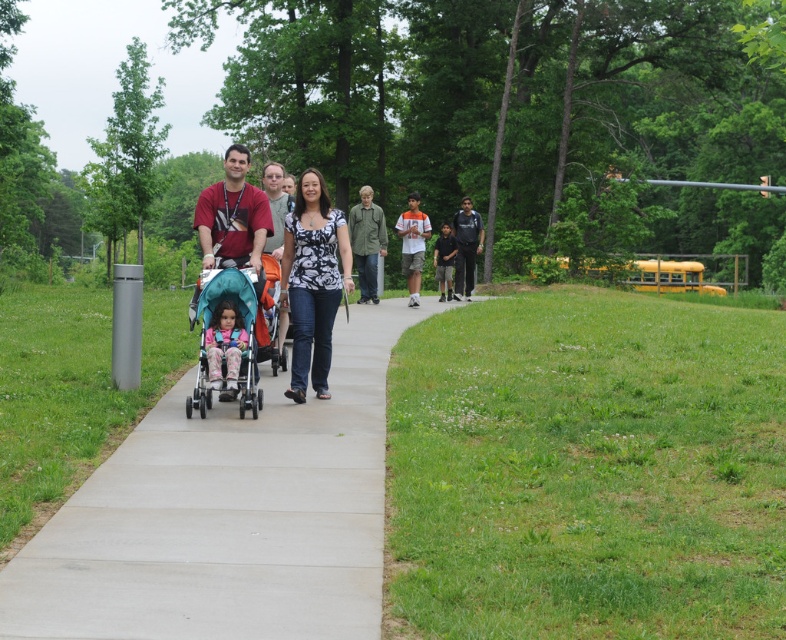
Question: Can you confirm if teal fabric stroller at center is smaller than yellow matte school bus at right?

Choices:
 (A) no
 (B) yes

Answer: (B)

Question: Does black and white printed blouse at center have a greater width compared to matte red shirt at center?

Choices:
 (A) yes
 (B) no

Answer: (B)

Question: Estimate the real-world distances between objects in this image. Which object is farther from the black cotton shirt at center?

Choices:
 (A) matte red shirt at center
 (B) concrete at center
 (C) matte teal stroller at center

Answer: (B)

Question: Which is nearer to the black and white printed blouse at center?

Choices:
 (A) matte red stroller at center
 (B) matte teal stroller at center
 (C) yellow matte school bus at right

Answer: (A)

Question: Which of the following is the closest to the observer?

Choices:
 (A) yellow matte school bus at right
 (B) teal fabric stroller at center
 (C) matte teal stroller at center
 (D) black and white printed blouse at center

Answer: (B)

Question: In this image, where is concrete at center located relative to teal fabric stroller at center?

Choices:
 (A) left
 (B) right

Answer: (B)